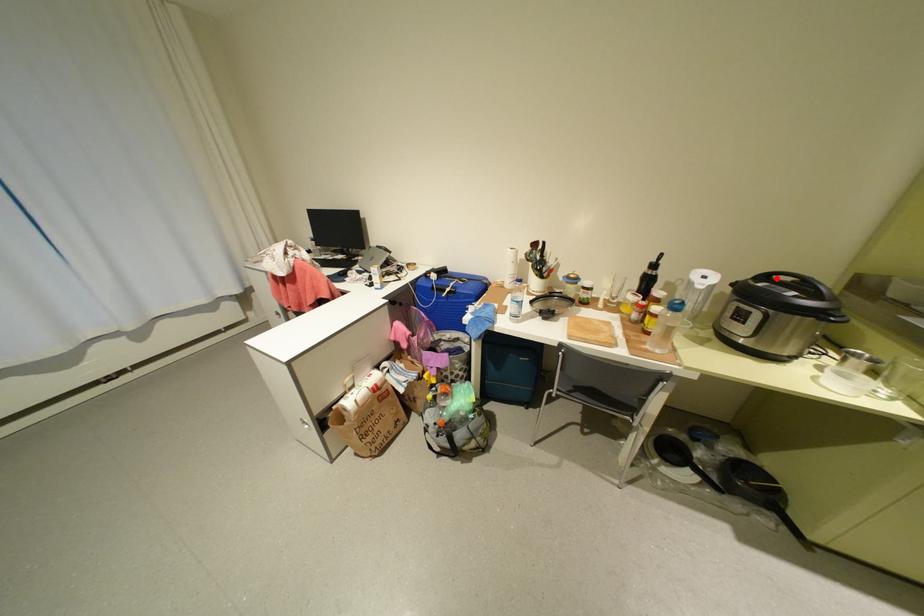
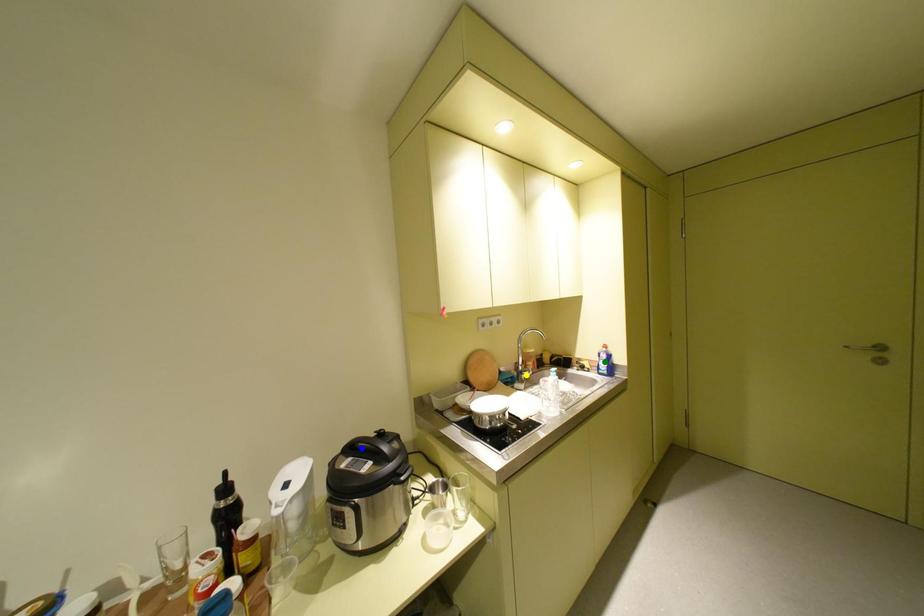
Question: I am providing you with two images of the same scene from different viewpoints. A red point is marked on the first image. You are given multiple points on the second image. Which spot in image 2 lines up with the point in image 1?

Choices:
 (A) yellow point
 (B) blue point
 (C) green point

Answer: (B)